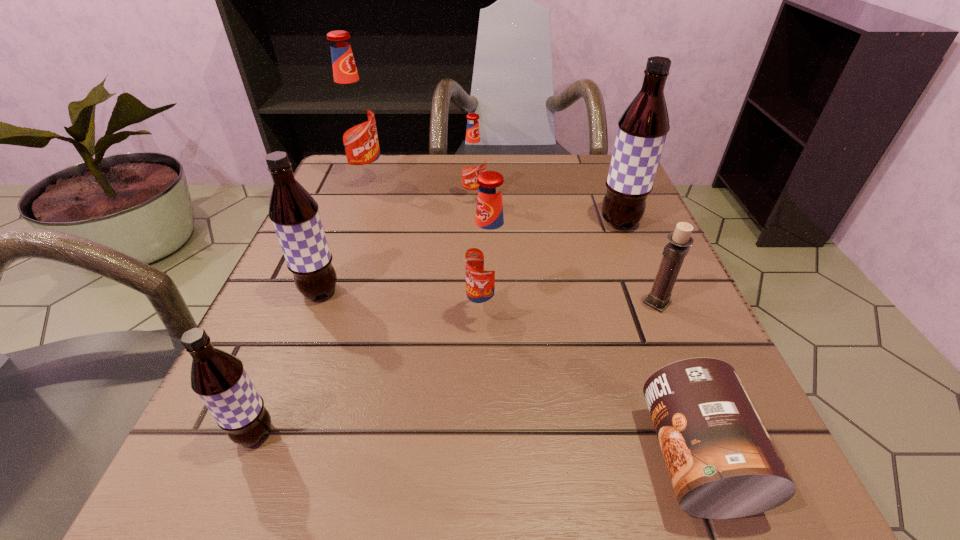
Where is `candle holder`? This screenshot has height=540, width=960. candle holder is located at coordinates (674, 252).

Where is `the shortest object`? the shortest object is located at coordinates (723, 464).

This screenshot has width=960, height=540. Identify the location of free space located 0.120m on the front of the farthest red root beer. (349, 222).

Where is `free space located on the front of the biggest brown root beer`? The image size is (960, 540). free space located on the front of the biggest brown root beer is located at coordinates (675, 359).

The width and height of the screenshot is (960, 540). I want to click on vacant space located on the back of the second nearest brown root beer, so click(x=343, y=232).

Identify the location of vacant space located on the back of the second smallest red root beer. (486, 186).

Identify the location of vacant region located on the left of the second nearest red root beer. (396, 199).

The image size is (960, 540). I want to click on vacant point located on the back of the nearest root beer, so click(x=308, y=301).

Locate an element on the screen. vacant space located 0.150m on the left of the candle holder is located at coordinates (548, 303).

Locate an element on the screen. blank space located 0.180m on the front label of the can is located at coordinates (493, 457).